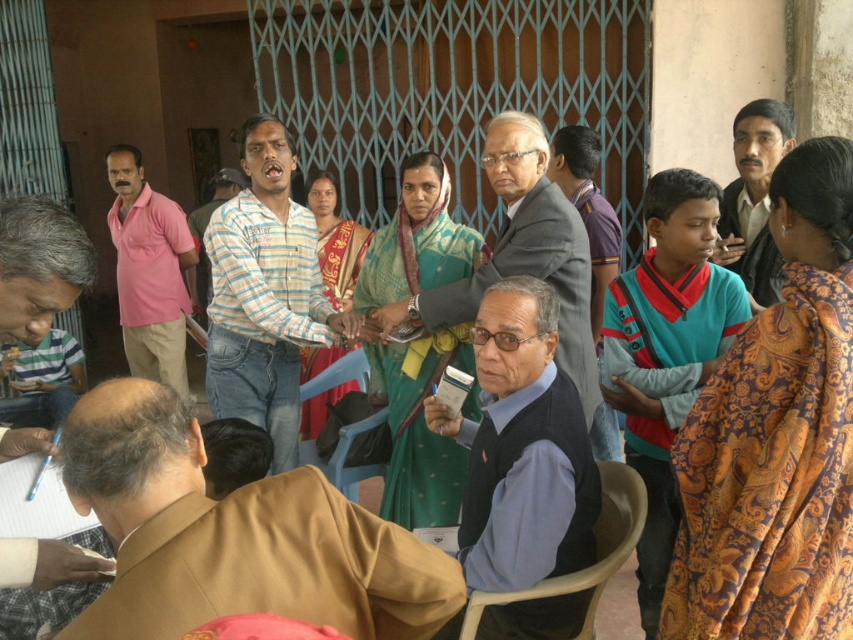
What is the 2D coordinate of the dark blue fabric vest at center in the image?

The dark blue fabric vest at center is located at the 2D coordinate point of (521,449).

You are an event planner arranging seating for a meeting. You notice the dark blue fabric vest at center and the pink cotton shirt at left in the image. Which participant should you seat first to accommodate their current position?

You should seat the dark blue fabric vest at center first because they are in front of the pink cotton shirt at left, indicating they are closer to the front and likely part of the main discussion area.

You are organizing a photo shoot and need to adjust the lighting. You have two subjects wearing the brown fabric jacket at lower left and the dark blue fabric vest at center. To ensure both are well lit, which subject should you focus the light on first based on their position?

The brown fabric jacket at lower left is in front of the dark blue fabric vest at center, so you should focus the light on the brown fabric jacket at lower left first to ensure it is well lit before adjusting for the one behind.